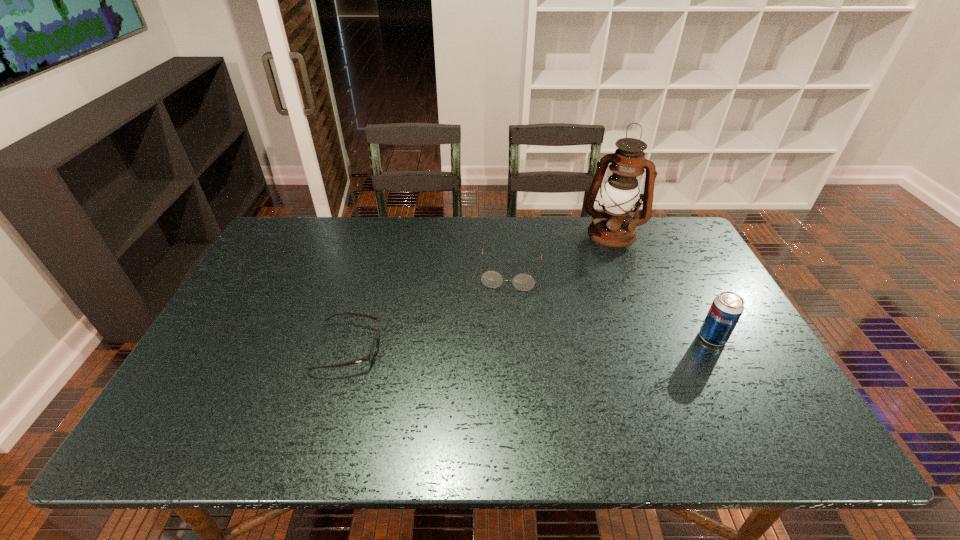
The image size is (960, 540). Find the location of `object that is positioned at the far right corner`. object that is positioned at the far right corner is located at coordinates (614, 227).

Image resolution: width=960 pixels, height=540 pixels. In order to click on free region at the far edge of the desktop in this screenshot , I will do `click(343, 259)`.

Where is `vacant region at the near edge`? vacant region at the near edge is located at coordinates (689, 390).

In the image, there is a desktop. Identify the location of vacant space at the left edge. The height and width of the screenshot is (540, 960). (272, 334).

Where is `vacant space at the right edge`? Image resolution: width=960 pixels, height=540 pixels. vacant space at the right edge is located at coordinates (739, 333).

In the image, there is a desktop. Where is `vacant space at the far left corner`? Image resolution: width=960 pixels, height=540 pixels. vacant space at the far left corner is located at coordinates coord(306,241).

At what (x,y) coordinates should I click in order to perform the action: click on vacant area at the near left corner. Please return your answer as a coordinate pair (x, y). Looking at the image, I should click on (232, 396).

I want to click on free space between the second tallest object and the second shortest object, so click(612, 305).

Identify the location of vacant area that lies between the farthest object and the third shortest object. (662, 285).

Locate an element on the screen. free space between the leftmost object and the lantern is located at coordinates (480, 290).